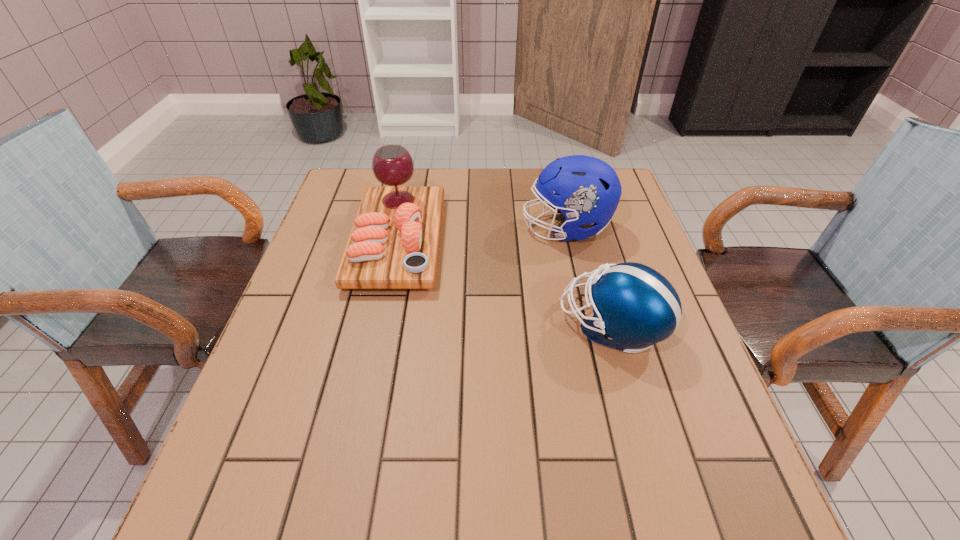
Locate an element on the screen. The height and width of the screenshot is (540, 960). free space located 0.050m at the front of the shortest object with the faceguard is located at coordinates (539, 326).

This screenshot has width=960, height=540. Identify the location of football helmet located in the far edge section of the desktop. 587,190.

The width and height of the screenshot is (960, 540). I want to click on platter present at the far edge, so pyautogui.click(x=394, y=242).

This screenshot has width=960, height=540. Identify the location of object that is at the left edge. (394, 242).

Identify the location of object at the far left corner. The height and width of the screenshot is (540, 960). (394, 242).

This screenshot has width=960, height=540. Identify the location of object present at the far right corner. (587, 190).

Where is `free spot at the far edge of the desktop`? free spot at the far edge of the desktop is located at coordinates (485, 179).

At what (x,y) coordinates should I click in order to perform the action: click on free space at the near edge of the desktop. Please return your answer as a coordinate pair (x, y). The width and height of the screenshot is (960, 540). Looking at the image, I should click on (502, 495).

You are a GUI agent. You are given a task and a screenshot of the screen. Output one action in this format:
    pyautogui.click(x=<x>, y=<y>)
    Task: Click on the vacant area at the left edge of the desktop
    The width and height of the screenshot is (960, 540).
    Given the screenshot: What is the action you would take?
    pyautogui.click(x=301, y=310)

In the image, there is a desktop. Where is `free space at the right edge`? Image resolution: width=960 pixels, height=540 pixels. free space at the right edge is located at coordinates (631, 242).